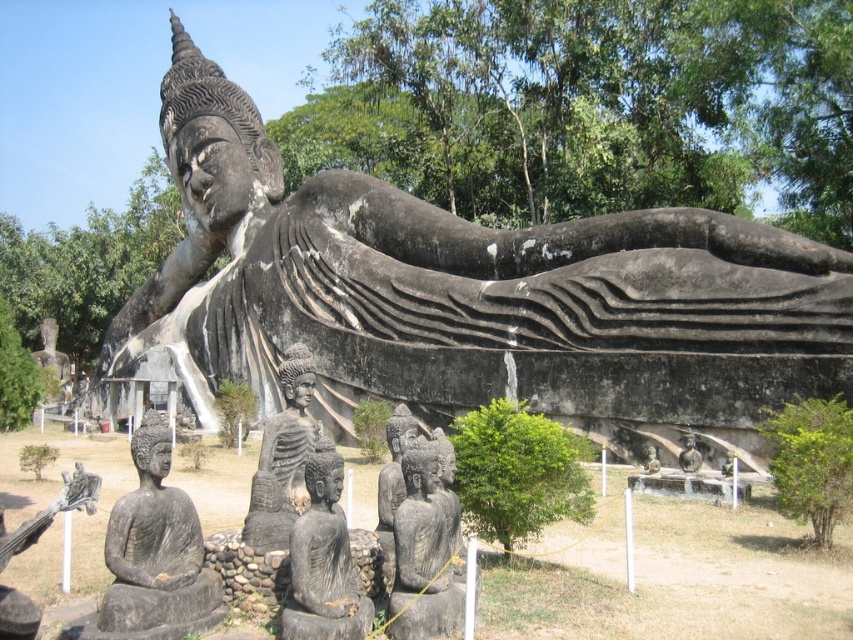
You are a visitor standing in front of the large reclining Buddha statue. You notice two smaller statues nearby. One is the black stone statue at lower left and the other is the smooth stone statue at center. Which of these two statues is wider?

The black stone statue at lower left might be wider than the smooth stone statue at center.